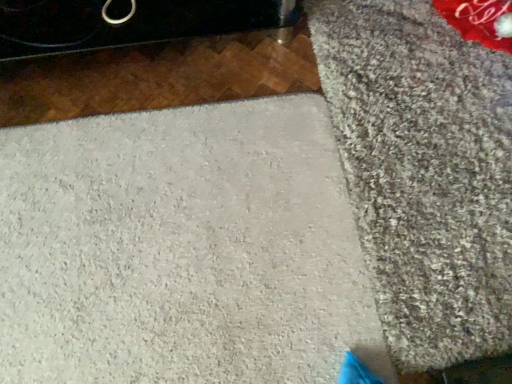
Question: Considering the positions of gray shaggy carpet at right and white textured concrete at center in the image, is gray shaggy carpet at right wider or thinner than white textured concrete at center?

Choices:
 (A) wide
 (B) thin

Answer: (B)

Question: Visually, is gray shaggy carpet at right positioned to the left or to the right of white textured concrete at center?

Choices:
 (A) left
 (B) right

Answer: (B)

Question: Considering their positions, is gray shaggy carpet at right located in front of or behind white textured concrete at center?

Choices:
 (A) front
 (B) behind

Answer: (B)

Question: From the image's perspective, is white textured concrete at center located above or below gray shaggy carpet at right?

Choices:
 (A) below
 (B) above

Answer: (A)

Question: From a real-world perspective, is white textured concrete at center above or below gray shaggy carpet at right?

Choices:
 (A) below
 (B) above

Answer: (A)

Question: Is white textured concrete at center to the left or to the right of gray shaggy carpet at right in the image?

Choices:
 (A) left
 (B) right

Answer: (A)

Question: Is white textured concrete at center in front of or behind gray shaggy carpet at right in the image?

Choices:
 (A) behind
 (B) front

Answer: (B)